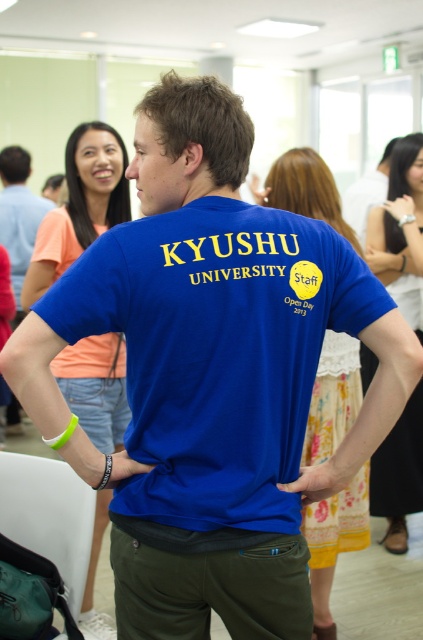
Is point (129, 508) positioned after point (80, 250)?

No, it is not.

Between blue cotton t-shirt at center and orange t-shirt at upper left, which one has less height?

blue cotton t-shirt at center is shorter.

Identify the location of blue cotton t-shirt at center. The image size is (423, 640). (216, 349).

Looking at this image, which of these two, orange t-shirt at upper left or light blue shirt at left, stands taller?

With more height is light blue shirt at left.

Who is positioned more to the left, orange t-shirt at upper left or light blue shirt at left?

Positioned to the left is light blue shirt at left.

What do you see at coordinates (79, 205) in the screenshot?
I see `orange t-shirt at upper left` at bounding box center [79, 205].

The width and height of the screenshot is (423, 640). What are the coordinates of `orange t-shirt at upper left` in the screenshot? It's located at (79, 205).

Where is `orange t-shirt at upper left`? This screenshot has height=640, width=423. orange t-shirt at upper left is located at coordinates (79, 205).

Who is higher up, orange t-shirt at upper left or blue fabric dress at right?

Positioned higher is blue fabric dress at right.

The width and height of the screenshot is (423, 640). In order to click on orange t-shirt at upper left in this screenshot , I will do `click(79, 205)`.